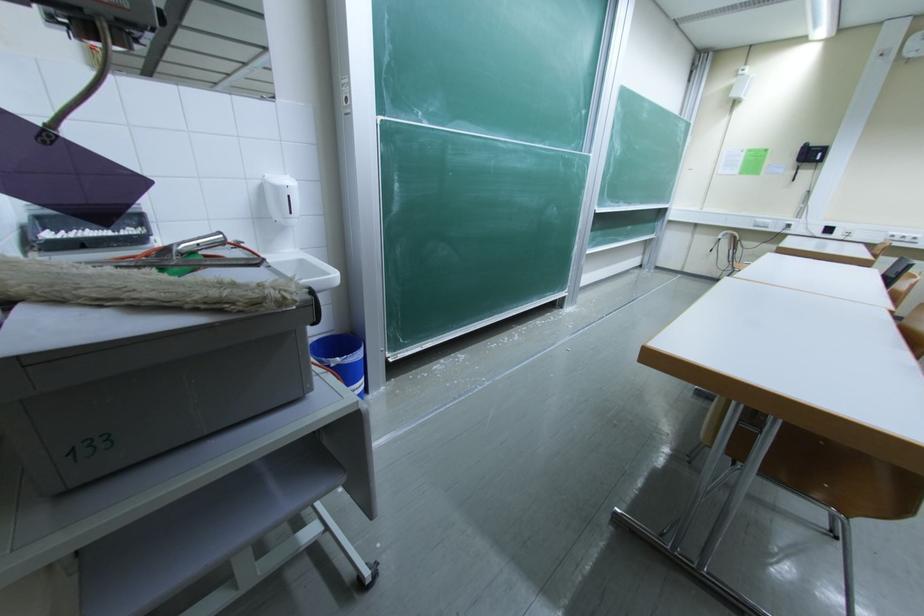
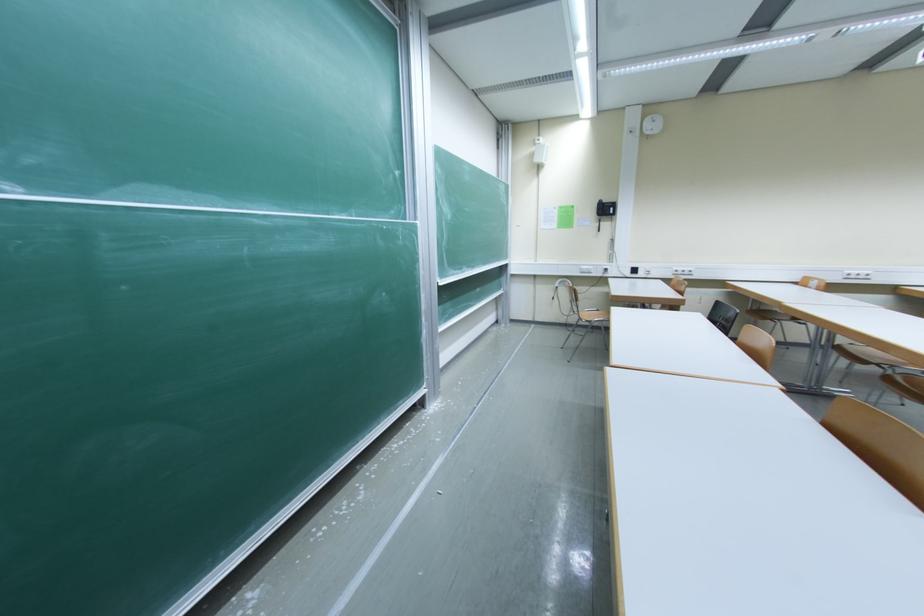
What movement of the cameraman would produce the second image?

The movement direction of the cameraman is right, forward.